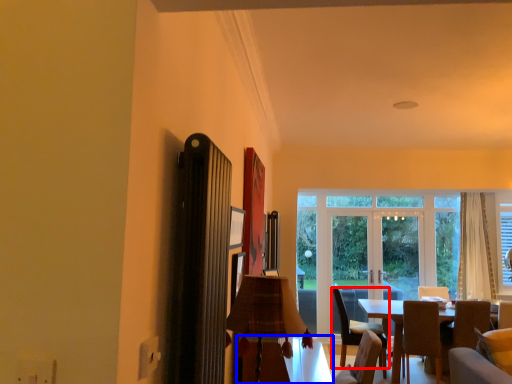
Question: Which point is further to the camera, chair (highlighted by a red box) or table (highlighted by a blue box)?

Choices:
 (A) chair
 (B) table

Answer: (A)